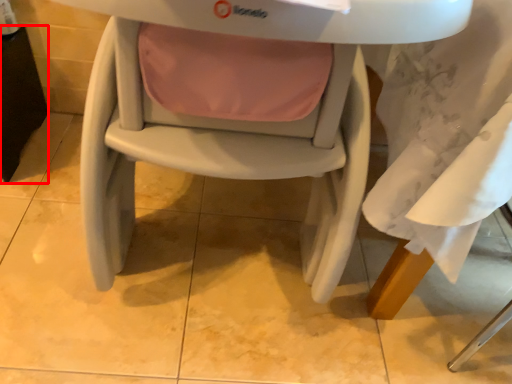
Question: Considering the relative positions of table (annotated by the red box) and chair in the image provided, where is table (annotated by the red box) located with respect to the staircase?

Choices:
 (A) right
 (B) left

Answer: (B)